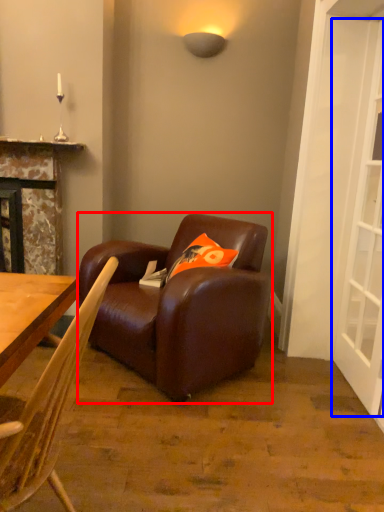
Question: Which of the following is the farthest to the observer, studio couch (highlighted by a red box) or screen door (highlighted by a blue box)?

Choices:
 (A) studio couch
 (B) screen door

Answer: (A)